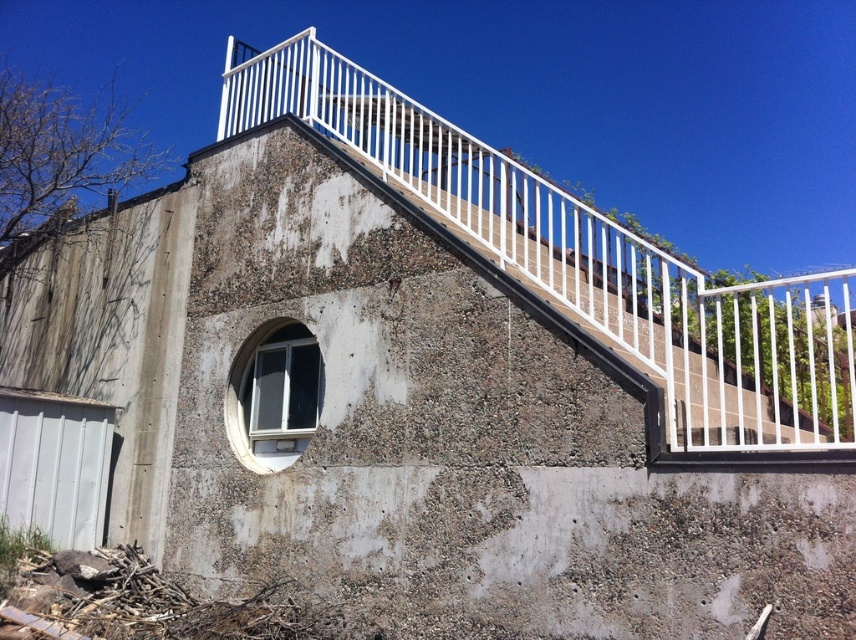
Which is above, white metal railing at upper center or clear glass window at center?

white metal railing at upper center is above.

Who is more distant from viewer, (664, 316) or (248, 454)?

Point (248, 454)

Who is more distant from viewer, (833, 392) or (319, 397)?

Point (319, 397)

Locate an element on the screen. This screenshot has width=856, height=640. white metal railing at upper center is located at coordinates (587, 260).